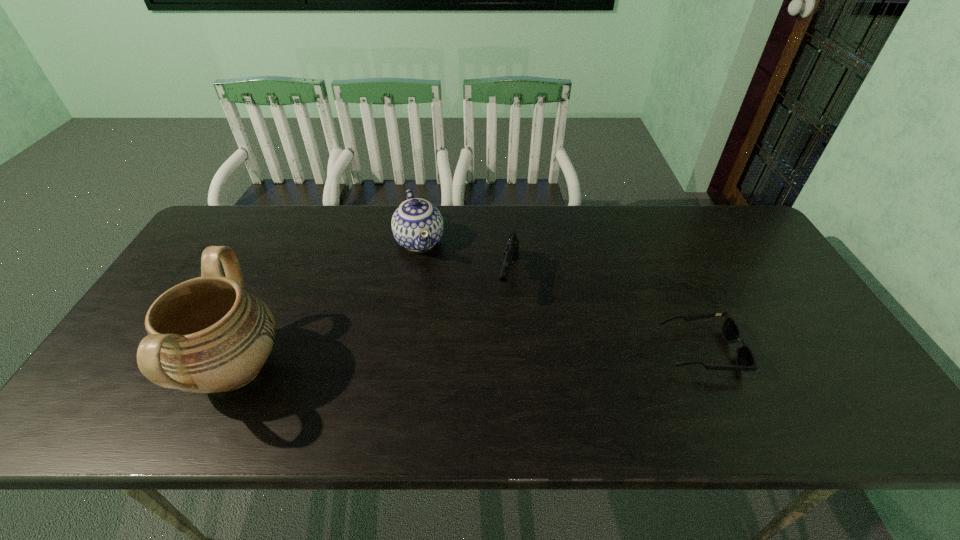
The image size is (960, 540). Identify the location of the tallest object. (205, 335).

Locate an element on the screen. The width and height of the screenshot is (960, 540). the leftmost object is located at coordinates (205, 335).

Locate an element on the screen. This screenshot has height=540, width=960. the shortest object is located at coordinates (745, 358).

You are a GUI agent. You are given a task and a screenshot of the screen. Output one action in this format:
    pyautogui.click(x=<x>, y=<y>)
    Task: Click on the sunglasses
    This screenshot has height=540, width=960.
    Given the screenshot: What is the action you would take?
    pyautogui.click(x=745, y=358)

Find the location of a particular element. the third tallest object is located at coordinates (511, 252).

Identify the location of gun. The width and height of the screenshot is (960, 540). (511, 252).

Find the location of a particular element. The width and height of the screenshot is (960, 540). the third object from right to left is located at coordinates (417, 225).

At what (x,y) coordinates should I click in order to perform the action: click on chinaware. Please return your answer as a coordinate pair (x, y). Looking at the image, I should click on (417, 225).

You are a GUI agent. You are given a task and a screenshot of the screen. Output one action in this format:
    pyautogui.click(x=<x>, y=<y>)
    Task: Click on the free space located 0.370m on the front-facing side of the tallest object
    
    Given the screenshot: What is the action you would take?
    pyautogui.click(x=443, y=369)

Find the location of a particular element. This screenshot has height=540, width=960. free space located 0.230m on the front-facing side of the shortest object is located at coordinates (831, 350).